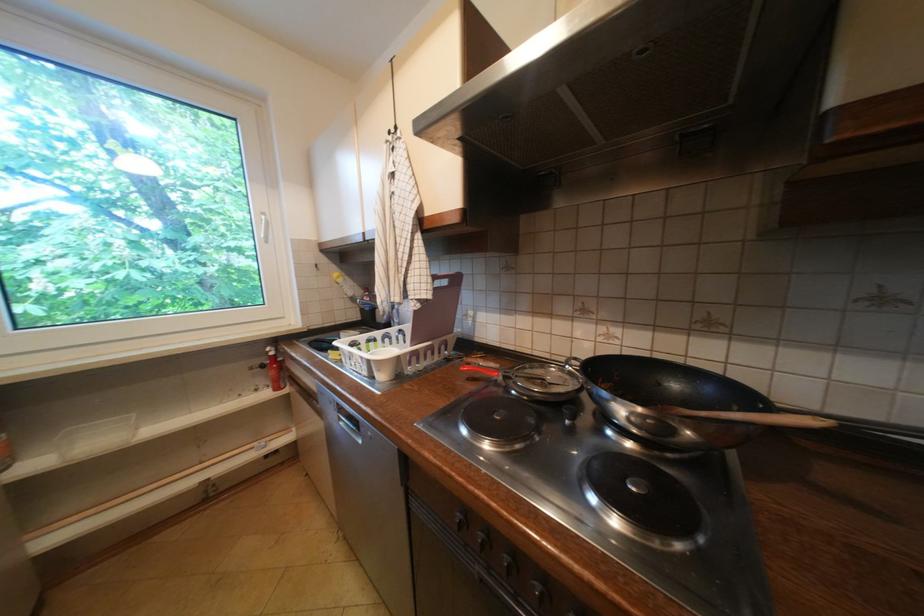
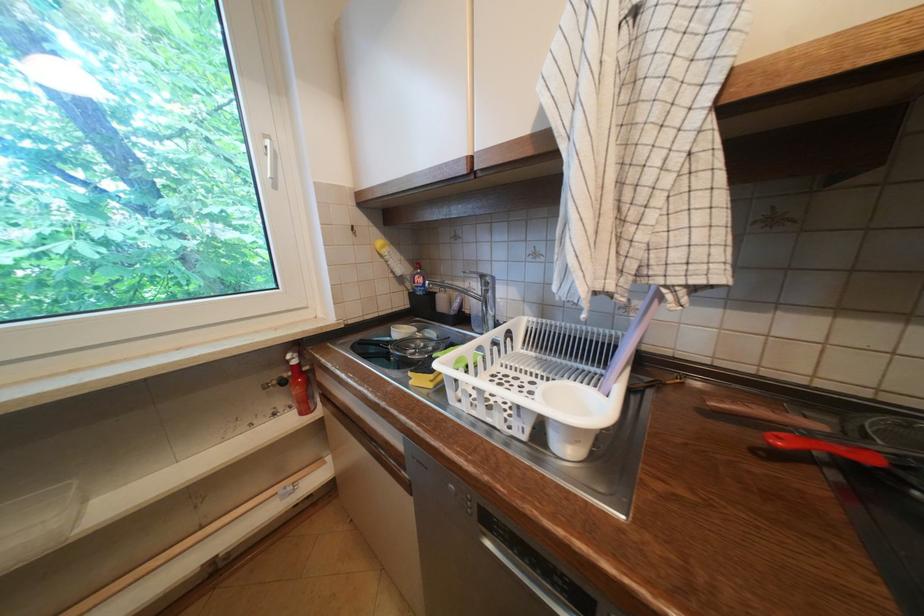
Find the pixel in the second image that matches (x=275, y=354) in the first image.

(296, 362)